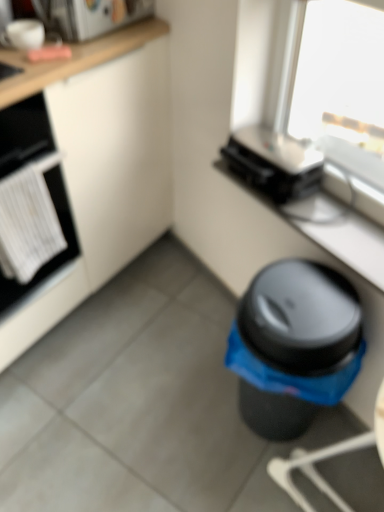
Locate an element on the screen. vacant area on top of black plastic waste bin at lower right (from a real-world perspective) is located at coordinates (303, 298).